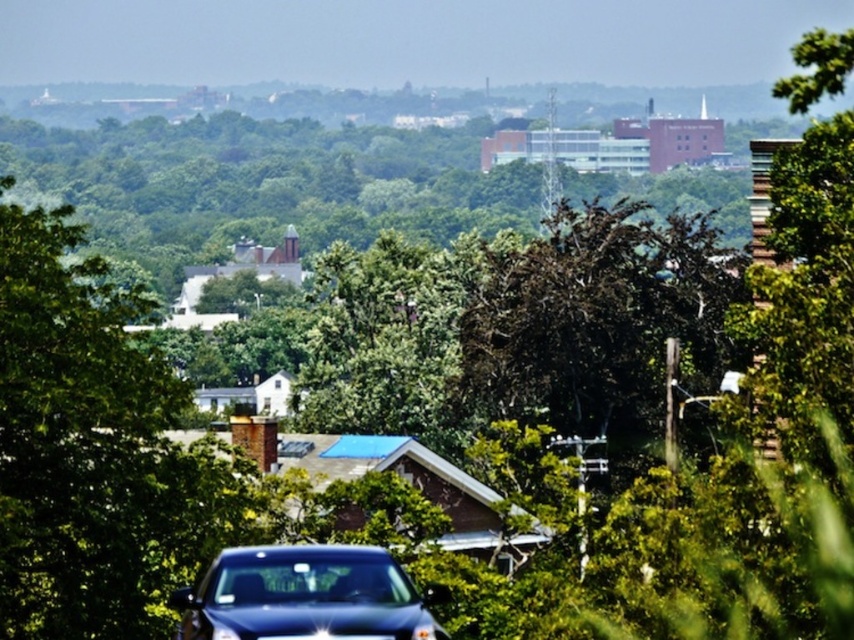
Can you confirm if green leafy tree at center is thinner than glossy dark blue car at lower center?

No.

Where is `green leafy tree at center`? Image resolution: width=854 pixels, height=640 pixels. green leafy tree at center is located at coordinates (94, 451).

Is point (60, 333) positioned in front of point (276, 577)?

No, (60, 333) is further to viewer.

You are a GUI agent. You are given a task and a screenshot of the screen. Output one action in this format:
    pyautogui.click(x=<x>, y=<y>)
    Task: Click on the green leafy tree at center
    The width and height of the screenshot is (854, 640).
    Given the screenshot: What is the action you would take?
    pyautogui.click(x=94, y=451)